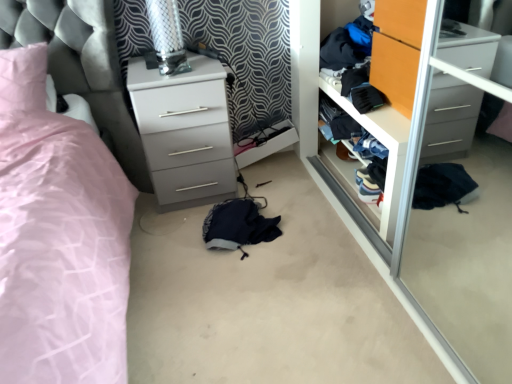
Identify the location of free space above white glossy chest of drawers at center (from a real-world perspective). (173, 65).